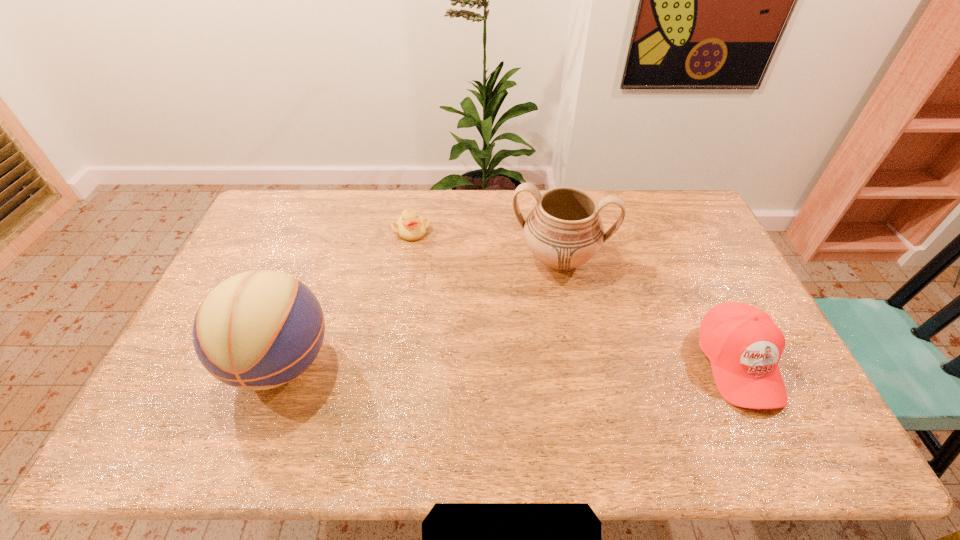
The image size is (960, 540). Identify the location of free location located 0.100m at the face of the duckling. (435, 257).

In order to click on blank space located 0.240m at the face of the duckling in this screenshot , I will do `click(457, 282)`.

Where is `object that is at the far edge`? The height and width of the screenshot is (540, 960). object that is at the far edge is located at coordinates (410, 226).

Where is `basketball positioned at the near edge`? The height and width of the screenshot is (540, 960). basketball positioned at the near edge is located at coordinates (257, 330).

I want to click on baseball cap situated at the near edge, so click(x=743, y=344).

At what (x,y) coordinates should I click in order to perform the action: click on object at the left edge. Please return your answer as a coordinate pair (x, y). Image resolution: width=960 pixels, height=540 pixels. Looking at the image, I should click on (257, 330).

Locate an element on the screen. object that is at the right edge is located at coordinates (743, 344).

Find the location of `object situated at the near left corner`. object situated at the near left corner is located at coordinates pos(257,330).

Locate an element on the screen. The height and width of the screenshot is (540, 960). object located in the near right corner section of the desktop is located at coordinates (743, 344).

Identify the location of vacant area at the far edge. This screenshot has height=540, width=960. (341, 220).